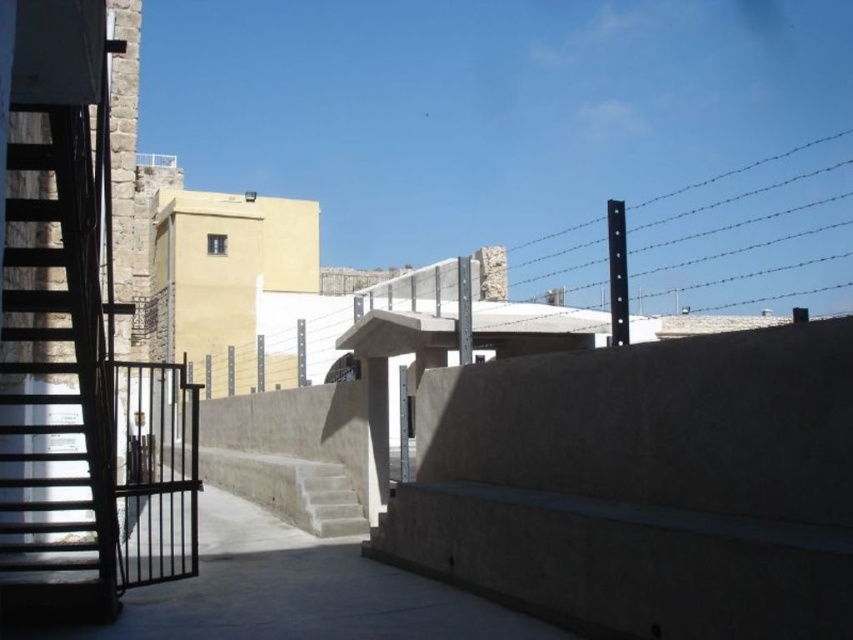
Question: Which of the following is the farthest from the observer?

Choices:
 (A) (337, 532)
 (B) (335, 467)

Answer: (B)

Question: Does smooth concrete stairs at center lie behind concrete stairs at center?

Choices:
 (A) no
 (B) yes

Answer: (B)

Question: Is smooth concrete stairs at center below concrete stairs at center?

Choices:
 (A) yes
 (B) no

Answer: (A)

Question: Can you confirm if smooth concrete stairs at center is positioned below concrete stairs at center?

Choices:
 (A) no
 (B) yes

Answer: (B)